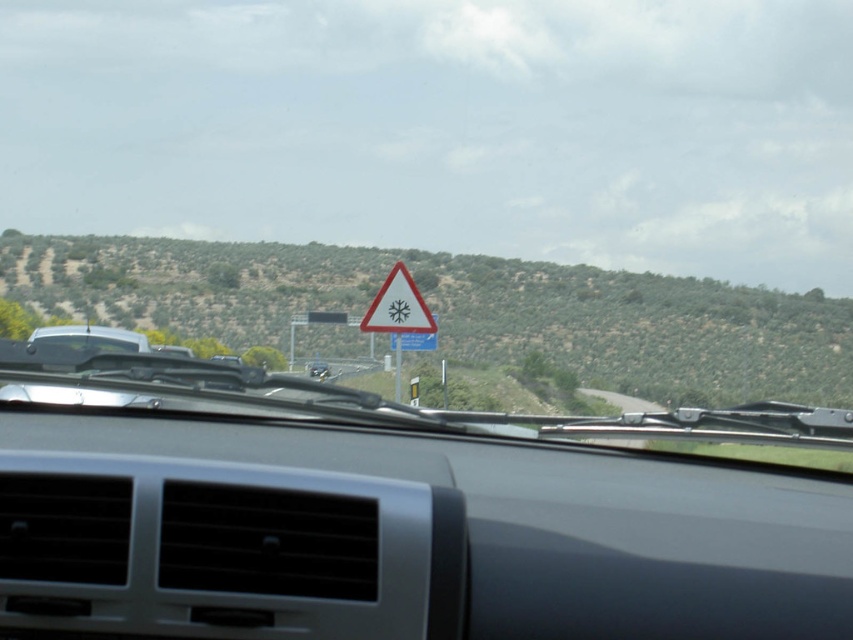
Which is behind, point (462, 584) or point (317, 368)?

The point (317, 368) is behind.

Is metallic dashboard at center thinner than matte black car at center?

In fact, metallic dashboard at center might be wider than matte black car at center.

Measure the distance between point (438,490) and camera.

The distance of point (438,490) from camera is 7.66 feet.

The height and width of the screenshot is (640, 853). Identify the location of metallic dashboard at center. (395, 513).

Is point (383, 321) in front of point (318, 369)?

Yes, point (383, 321) is in front of point (318, 369).

Based on the photo, who is more forward, (386, 301) or (322, 374)?

Positioned in front is point (386, 301).

Identify the location of white triangular warning sign at center. (398, 307).

Is the position of metallic dashboard at center more distant than that of white triangular warning sign at center?

No, metallic dashboard at center is closer to the viewer.

The image size is (853, 640). What do you see at coordinates (395, 513) in the screenshot?
I see `metallic dashboard at center` at bounding box center [395, 513].

Who is more distant from viewer, (392,534) or (387,324)?

The point (387,324) is behind.

The height and width of the screenshot is (640, 853). I want to click on metallic dashboard at center, so click(395, 513).